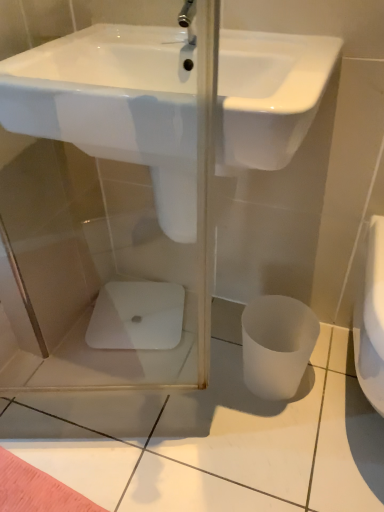
Identify the location of blank area beneath white glossy sink at upper center (from a real-world perspective). (211, 349).